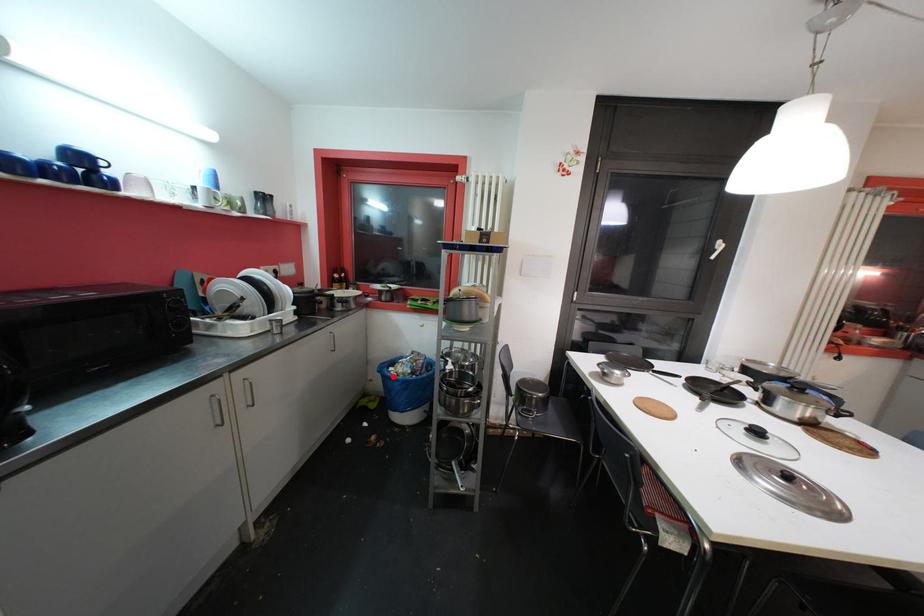
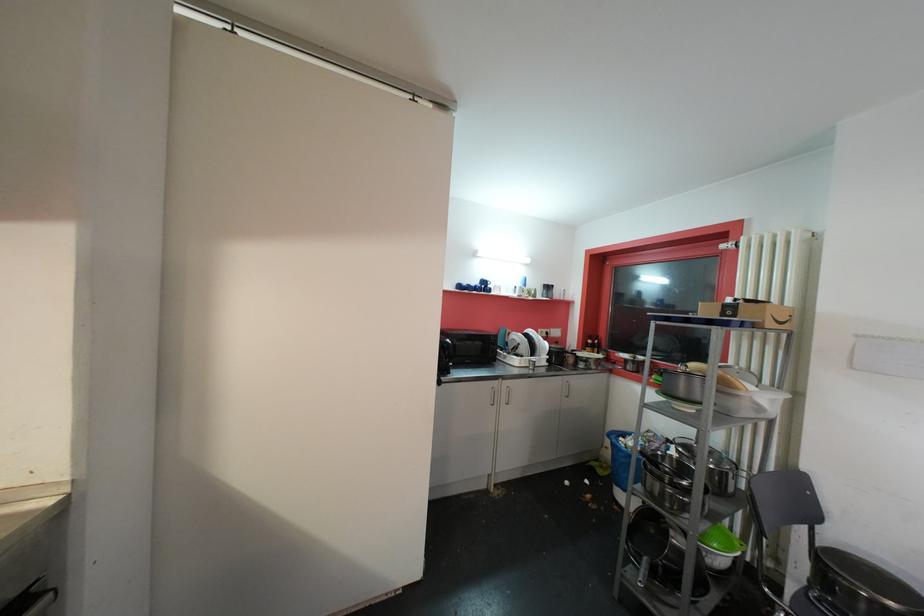
Question: I am providing you with two images of the same scene from different viewpoints. Image1 has a red point marked. In image2, the corresponding 3D location appears at what relative position? Reply with the corresponding letter.

Choices:
 (A) Closer
 (B) Farther

Answer: (A)